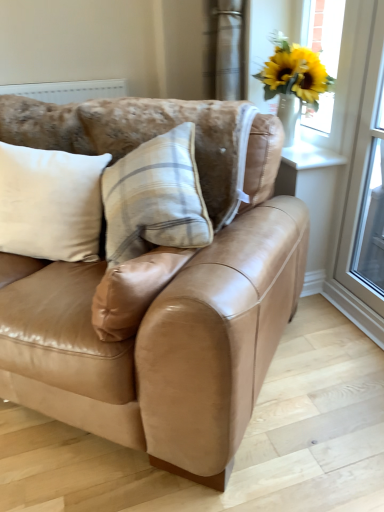
Question: From the image's perspective, is transparent glass screen door at right over white soft cushion at left?

Choices:
 (A) yes
 (B) no

Answer: (A)

Question: Considering the relative sizes of transparent glass screen door at right and white soft cushion at left in the image provided, is transparent glass screen door at right wider than white soft cushion at left?

Choices:
 (A) yes
 (B) no

Answer: (B)

Question: Is transparent glass screen door at right positioned beyond the bounds of white soft cushion at left?

Choices:
 (A) yes
 (B) no

Answer: (A)

Question: Considering the relative positions of transparent glass screen door at right and white soft cushion at left in the image provided, is transparent glass screen door at right to the right of white soft cushion at left from the viewer's perspective?

Choices:
 (A) no
 (B) yes

Answer: (B)

Question: Are transparent glass screen door at right and white soft cushion at left located far from each other?

Choices:
 (A) no
 (B) yes

Answer: (B)

Question: Is point (372, 194) positioned closer to the camera than point (94, 199)?

Choices:
 (A) farther
 (B) closer

Answer: (A)

Question: Looking at the image, does transparent glass screen door at right seem bigger or smaller compared to white soft cushion at left?

Choices:
 (A) big
 (B) small

Answer: (A)

Question: From a real-world perspective, is transparent glass screen door at right positioned above or below white soft cushion at left?

Choices:
 (A) above
 (B) below

Answer: (A)

Question: Is transparent glass screen door at right situated inside white soft cushion at left or outside?

Choices:
 (A) outside
 (B) inside

Answer: (A)

Question: From their relative heights in the image, would you say transparent glass window at upper right is taller or shorter than transparent glass screen door at right?

Choices:
 (A) short
 (B) tall

Answer: (A)

Question: Choose the correct answer: Is transparent glass window at upper right inside transparent glass screen door at right or outside it?

Choices:
 (A) inside
 (B) outside

Answer: (B)

Question: From a real-world perspective, is transparent glass window at upper right above or below transparent glass screen door at right?

Choices:
 (A) above
 (B) below

Answer: (B)

Question: Is transparent glass window at upper right wider or thinner than transparent glass screen door at right?

Choices:
 (A) thin
 (B) wide

Answer: (A)

Question: Considering their positions, is yellow artificial flowers in vase at upper right located in front of or behind transparent glass window at upper right?

Choices:
 (A) behind
 (B) front

Answer: (B)

Question: Is yellow artificial flowers in vase at upper right inside or outside of transparent glass window at upper right?

Choices:
 (A) inside
 (B) outside

Answer: (B)